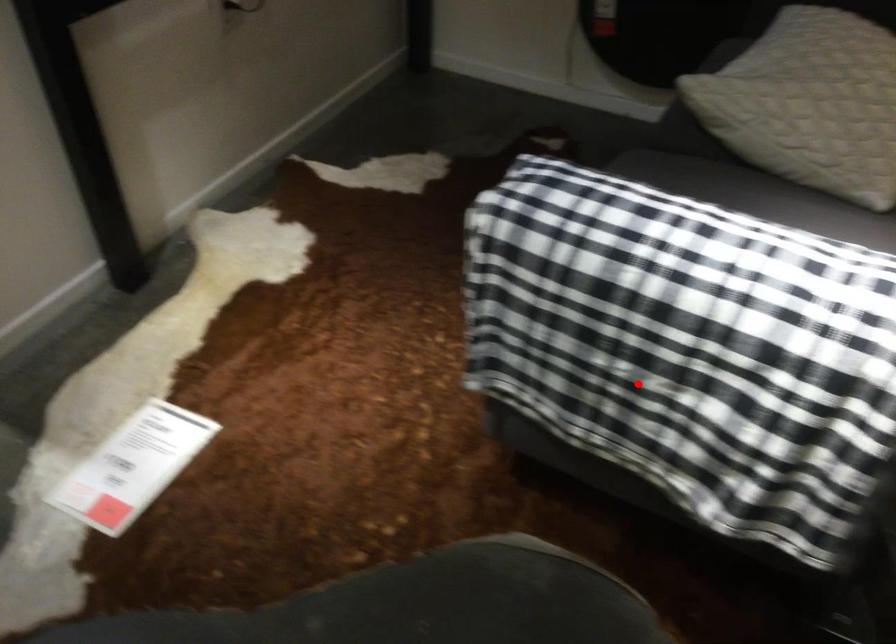
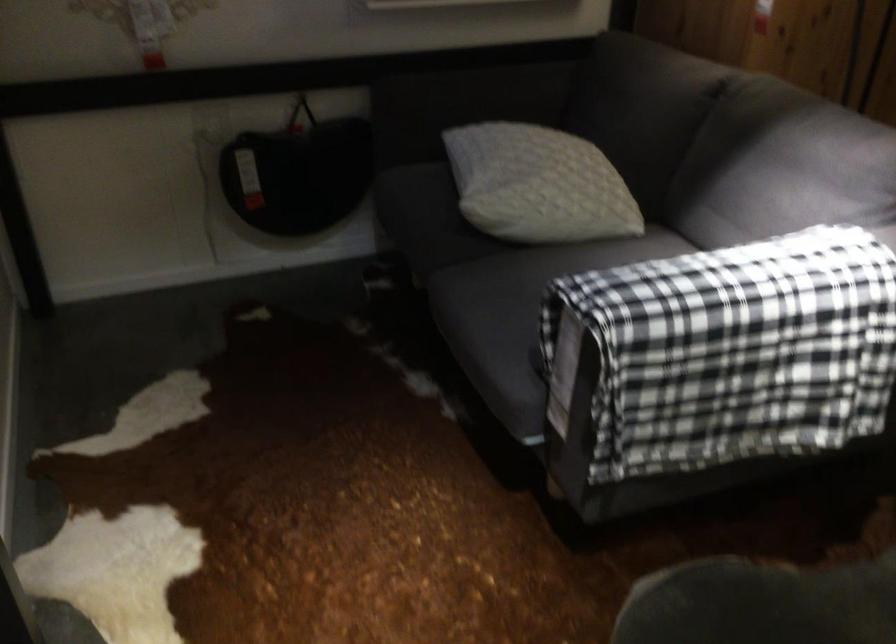
Find the pixel in the second image that matches the highlighted location in the first image.

(745, 388)